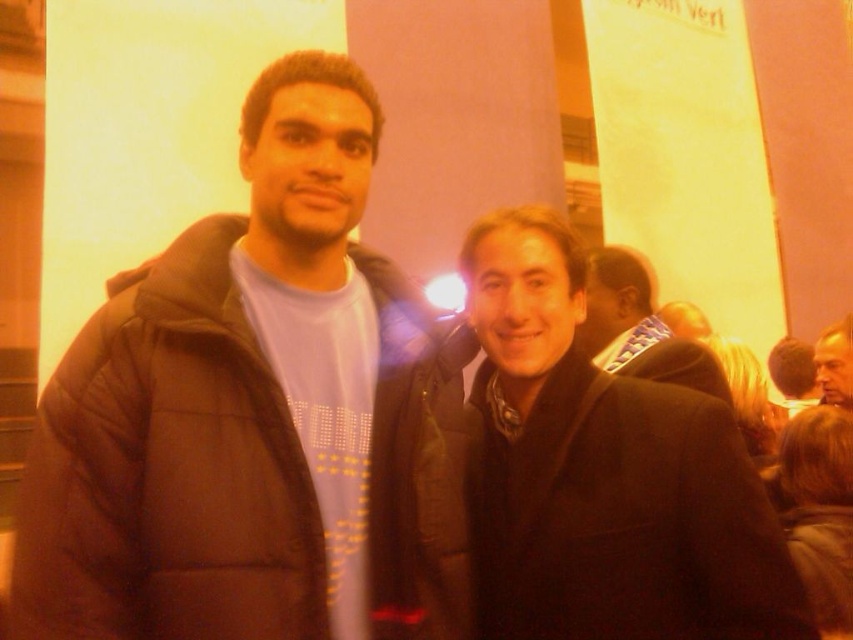
In the scene shown: You are a photographer at the event and need to adjust the lighting to ensure both the black puffy jacket at left and the black matte coat at center are evenly lit. Given their sizes, which one might require more light to appear properly illuminated in the photo?

The black puffy jacket at left is wider than the black matte coat at center, so it might require more light to ensure proper illumination in the photo.

You are at a party and want to take a photo with the black puffy jacket at left and the matte black jacket at center. Which jacket should you stand to the right of to include both in the frame?

You should stand to the right of the matte black jacket at center to include both the black puffy jacket at left and the matte black jacket at center in the frame, as the black puffy jacket at left is positioned to the left of the matte black jacket at center.

You are planning to borrow a jacket from a friend who is wearing either the black puffy jacket at left or the matte black jacket at center. If you want the one that is bigger in size, which jacket should you choose?

The black puffy jacket at left has a larger size compared to the matte black jacket at center, so you should choose the black puffy jacket at left.